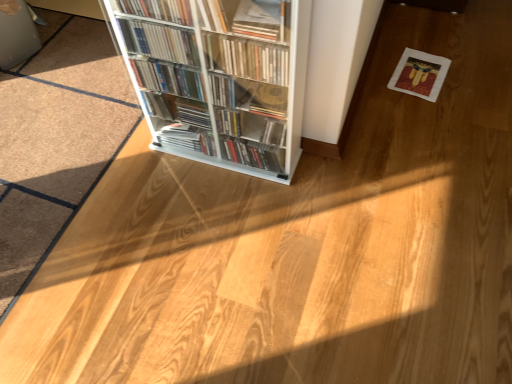
You are a GUI agent. You are given a task and a screenshot of the screen. Output one action in this format:
    pyautogui.click(x=<x>, y=<y>)
    Task: Click on the free space in front of white glossy bookcase at center
    The width and height of the screenshot is (512, 384).
    Given the screenshot: What is the action you would take?
    tap(227, 228)